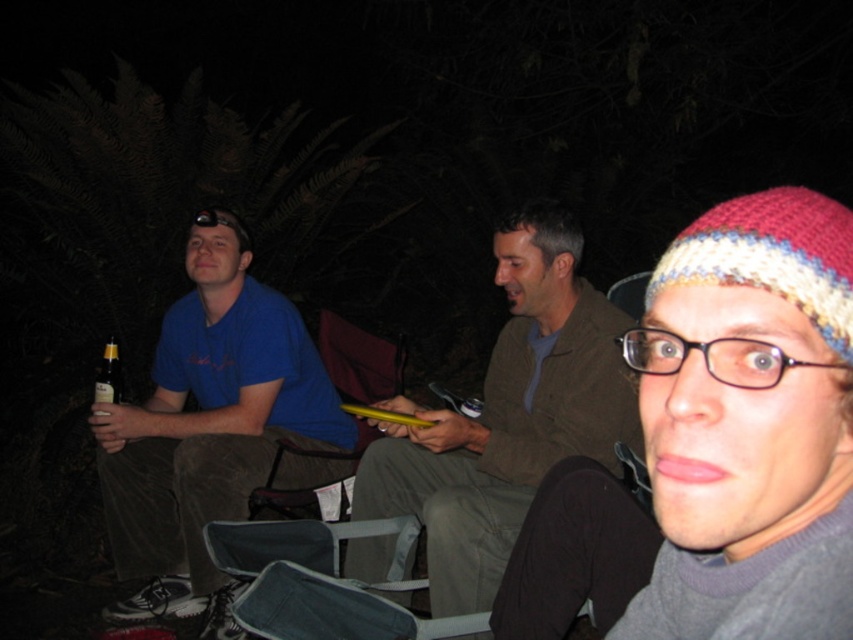
Question: Does knitted wool hat at upper right have a greater width compared to brown glass bottle at lower left?

Choices:
 (A) no
 (B) yes

Answer: (B)

Question: Can you confirm if blue cotton shirt at left is positioned above brown fabric jacket at center?

Choices:
 (A) no
 (B) yes

Answer: (A)

Question: Which object is farther from the camera taking this photo?

Choices:
 (A) knitted wool hat at upper right
 (B) brown glass bottle at lower left

Answer: (B)

Question: Which point is farther from the camera taking this photo?

Choices:
 (A) (102, 401)
 (B) (173, 484)
 (C) (672, 296)
 (D) (577, 280)

Answer: (B)

Question: Is knitted wool hat at upper right positioned at the back of brown glass bottle at lower left?

Choices:
 (A) yes
 (B) no

Answer: (B)

Question: Which point appears farthest from the camera in this image?

Choices:
 (A) (679, 499)
 (B) (107, 394)

Answer: (B)